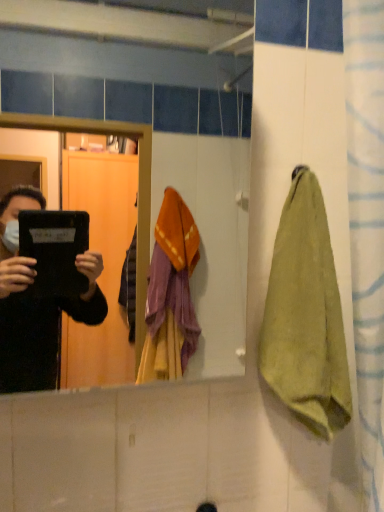
Question: Does matte black tablet at center have a greater height compared to green cotton towel at right?

Choices:
 (A) yes
 (B) no

Answer: (A)

Question: Can you confirm if matte black tablet at center is bigger than green cotton towel at right?

Choices:
 (A) no
 (B) yes

Answer: (B)

Question: Can you confirm if matte black tablet at center is smaller than green cotton towel at right?

Choices:
 (A) yes
 (B) no

Answer: (B)

Question: Is matte black tablet at center to the right of green cotton towel at right from the viewer's perspective?

Choices:
 (A) yes
 (B) no

Answer: (B)

Question: From a real-world perspective, is matte black tablet at center physically above green cotton towel at right?

Choices:
 (A) no
 (B) yes

Answer: (B)

Question: Considering the relative sizes of matte black tablet at center and green cotton towel at right in the image provided, is matte black tablet at center wider than green cotton towel at right?

Choices:
 (A) yes
 (B) no

Answer: (A)

Question: Is the depth of green cotton towel at right less than that of matte black tablet at center?

Choices:
 (A) yes
 (B) no

Answer: (B)

Question: Is green cotton towel at right thinner than matte black tablet at center?

Choices:
 (A) yes
 (B) no

Answer: (A)

Question: Is green cotton towel at right positioned far away from matte black tablet at center?

Choices:
 (A) no
 (B) yes

Answer: (A)

Question: From the image's perspective, does green cotton towel at right appear lower than matte black tablet at center?

Choices:
 (A) yes
 (B) no

Answer: (A)

Question: Is green cotton towel at right shorter than matte black tablet at center?

Choices:
 (A) yes
 (B) no

Answer: (A)

Question: Is green cotton towel at right bigger than matte black tablet at center?

Choices:
 (A) yes
 (B) no

Answer: (B)

Question: Looking at the image, does green cotton towel at right seem bigger or smaller compared to matte black tablet at center?

Choices:
 (A) big
 (B) small

Answer: (B)